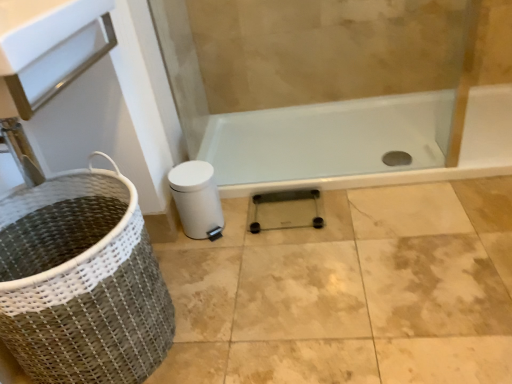
In order to click on spots to the right of woven fabric basket at lower left in this screenshot , I will do `click(239, 309)`.